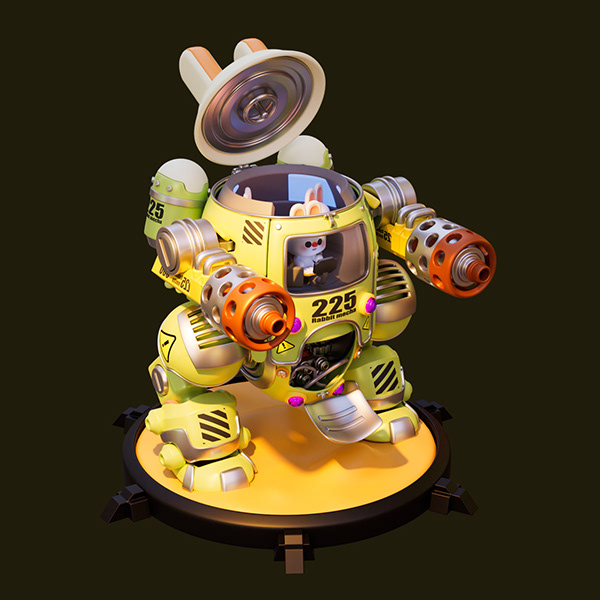
Identify the location of feet for standing display pad. This screenshot has width=600, height=600. (292, 545), (456, 494), (436, 408), (117, 498), (135, 411).